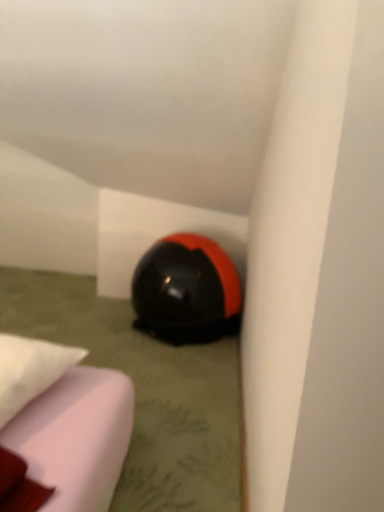
What do you see at coordinates (186, 290) in the screenshot? The width and height of the screenshot is (384, 512). I see `black glossy helmet at lower center` at bounding box center [186, 290].

You are a GUI agent. You are given a task and a screenshot of the screen. Output one action in this format:
    pyautogui.click(x=<x>, y=<y>)
    Task: Click on the black glossy helmet at lower center
    This screenshot has width=384, height=512.
    Given the screenshot: What is the action you would take?
    pyautogui.click(x=186, y=290)

What is the approximate height of white fabric pillow at lower left?

2.62 inches.

At what (x,y) coordinates should I click in order to perform the action: click on white fabric pillow at lower left. Please return your answer as a coordinate pair (x, y). Image resolution: width=384 pixels, height=512 pixels. Looking at the image, I should click on (30, 370).

The height and width of the screenshot is (512, 384). Describe the element at coordinates (30, 370) in the screenshot. I see `white fabric pillow at lower left` at that location.

The width and height of the screenshot is (384, 512). Identify the location of black glossy helmet at lower center. (186, 290).

Considering the relative positions of black glossy helmet at lower center and white fabric pillow at lower left in the image provided, is black glossy helmet at lower center to the right of white fabric pillow at lower left from the viewer's perspective?

Correct, you'll find black glossy helmet at lower center to the right of white fabric pillow at lower left.

Between black glossy helmet at lower center and white fabric pillow at lower left, which one is positioned behind?

black glossy helmet at lower center is behind.

Does point (179, 320) come closer to viewer compared to point (43, 383)?

No, it is not.

From the image's perspective, is black glossy helmet at lower center on top of white fabric pillow at lower left?

Indeed, from the image's perspective, black glossy helmet at lower center is shown above white fabric pillow at lower left.

From a real-world perspective, is black glossy helmet at lower center located beneath white fabric pillow at lower left?

Correct, in the physical world, black glossy helmet at lower center is lower than white fabric pillow at lower left.

Can you confirm if black glossy helmet at lower center is wider than white fabric pillow at lower left?

Indeed, black glossy helmet at lower center has a greater width compared to white fabric pillow at lower left.

Considering the relative sizes of black glossy helmet at lower center and white fabric pillow at lower left in the image provided, is black glossy helmet at lower center shorter than white fabric pillow at lower left?

No.

Can you confirm if black glossy helmet at lower center is bigger than white fabric pillow at lower left?

Yes.

Looking at this image, is black glossy helmet at lower center located outside white fabric pillow at lower left?

Yes, black glossy helmet at lower center is outside of white fabric pillow at lower left.

Would you consider black glossy helmet at lower center to be distant from white fabric pillow at lower left?

No, there isn't a large distance between black glossy helmet at lower center and white fabric pillow at lower left.

Is black glossy helmet at lower center aimed at white fabric pillow at lower left?

Yes, black glossy helmet at lower center faces towards white fabric pillow at lower left.

Identify the location of helmet lying behind the white fabric pillow at lower left. Image resolution: width=384 pixels, height=512 pixels. (186, 290).

Would you say white fabric pillow at lower left is to the left or to the right of black glossy helmet at lower center in the picture?

In the image, white fabric pillow at lower left appears on the left side of black glossy helmet at lower center.

Is white fabric pillow at lower left further to camera compared to black glossy helmet at lower center?

No, it is in front of black glossy helmet at lower center.

Which is less distant, (x=48, y=369) or (x=197, y=309)?

Point (x=48, y=369) is closer to the camera than point (x=197, y=309).

From the image's perspective, between white fabric pillow at lower left and black glossy helmet at lower center, which one is located above?

black glossy helmet at lower center.

Looking at this image, from a real-world perspective, is white fabric pillow at lower left physically below black glossy helmet at lower center?

No, from a real-world perspective, white fabric pillow at lower left is not below black glossy helmet at lower center.

Does white fabric pillow at lower left have a lesser width compared to black glossy helmet at lower center?

Indeed, white fabric pillow at lower left has a lesser width compared to black glossy helmet at lower center.

Considering the sizes of white fabric pillow at lower left and black glossy helmet at lower center in the image, is white fabric pillow at lower left taller or shorter than black glossy helmet at lower center?

Clearly, white fabric pillow at lower left is shorter compared to black glossy helmet at lower center.

Between white fabric pillow at lower left and black glossy helmet at lower center, which one has smaller size?

white fabric pillow at lower left is smaller.

In the scene shown: Is white fabric pillow at lower left not within black glossy helmet at lower center?

white fabric pillow at lower left lies outside black glossy helmet at lower center's area.

Is white fabric pillow at lower left next to black glossy helmet at lower center?

No, white fabric pillow at lower left is not with black glossy helmet at lower center.

Is white fabric pillow at lower left positioned with its back to black glossy helmet at lower center?

white fabric pillow at lower left does not have its back to black glossy helmet at lower center.

How different are the orientations of white fabric pillow at lower left and black glossy helmet at lower center in degrees?

They differ by 170 degrees in their facing directions.

I want to click on pillow in front of the black glossy helmet at lower center, so click(30, 370).

Find the location of `helmet that is on the right side of white fabric pillow at lower left`. helmet that is on the right side of white fabric pillow at lower left is located at coordinates (186, 290).

Image resolution: width=384 pixels, height=512 pixels. What are the coordinates of `pillow in front of the black glossy helmet at lower center` in the screenshot? It's located at (30, 370).